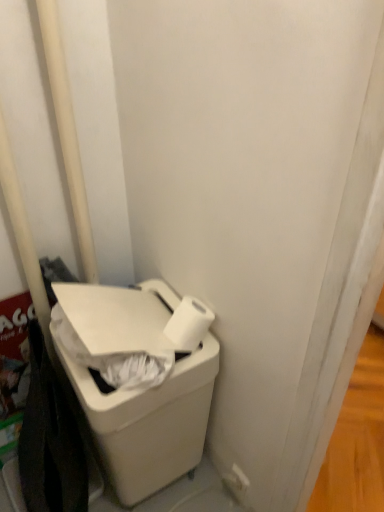
Question: Could white plastic waste container at lower left be considered to be inside white plastic pole at left?

Choices:
 (A) yes
 (B) no

Answer: (B)

Question: From a real-world perspective, is white plastic pole at left positioned under white plastic waste container at lower left based on gravity?

Choices:
 (A) no
 (B) yes

Answer: (A)

Question: Does white plastic pole at left appear on the right side of white plastic waste container at lower left?

Choices:
 (A) no
 (B) yes

Answer: (A)

Question: Is white plastic pole at left bigger than white plastic waste container at lower left?

Choices:
 (A) no
 (B) yes

Answer: (A)

Question: Is white plastic pole at left completely or partially outside of white plastic waste container at lower left?

Choices:
 (A) no
 (B) yes

Answer: (B)

Question: Considering the relative sizes of white plastic pole at left and white plastic waste container at lower left in the image provided, is white plastic pole at left thinner than white plastic waste container at lower left?

Choices:
 (A) no
 (B) yes

Answer: (B)

Question: Could you tell me if white plastic pole at left is turned towards white matte toilet paper at lower right?

Choices:
 (A) yes
 (B) no

Answer: (B)

Question: Is the depth of white plastic pole at left greater than that of white matte toilet paper at lower right?

Choices:
 (A) no
 (B) yes

Answer: (A)

Question: Can you confirm if white plastic pole at left is bigger than white matte toilet paper at lower right?

Choices:
 (A) yes
 (B) no

Answer: (A)

Question: Is white plastic pole at left surrounding white matte toilet paper at lower right?

Choices:
 (A) no
 (B) yes

Answer: (A)

Question: From the image's perspective, does white plastic pole at left appear lower than white matte toilet paper at lower right?

Choices:
 (A) no
 (B) yes

Answer: (A)

Question: Considering the relative positions of white plastic pole at left and white matte toilet paper at lower right in the image provided, is white plastic pole at left to the left of white matte toilet paper at lower right from the viewer's perspective?

Choices:
 (A) yes
 (B) no

Answer: (A)

Question: Could you tell me if white matte toilet paper at lower right is turned towards white plastic pole at left?

Choices:
 (A) no
 (B) yes

Answer: (A)